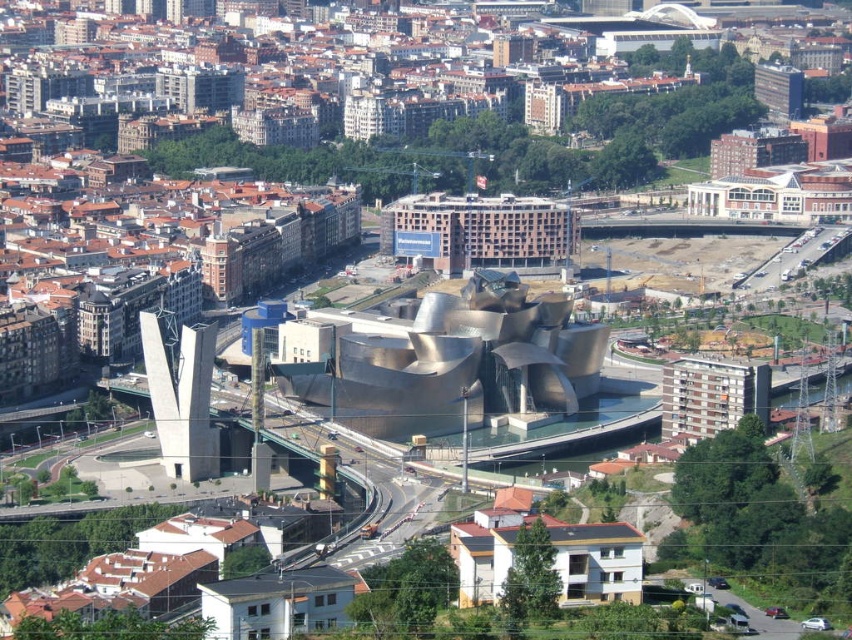
You are standing at the center of a city park and want to reach the point marked as point (378, 435) in the cityscape. If your walking speed is 3 feet per second, how long will it take you to reach that point?

The point (378, 435) is 1473.99 feet away from the viewer. At a walking speed of 3 feet per second, it would take approximately 491.33 seconds to reach the point.

You are a drone operator trying to capture the metallic silver building at center and the white painted concrete building at lower center in a single aerial shot. Based on their positions, which building should be placed on the left side of the frame to include both in the shot?

The metallic silver building at center is positioned on the left side of white painted concrete building at lower center, so to include both in the shot, the metallic silver building at center should be placed on the left side of the frame.